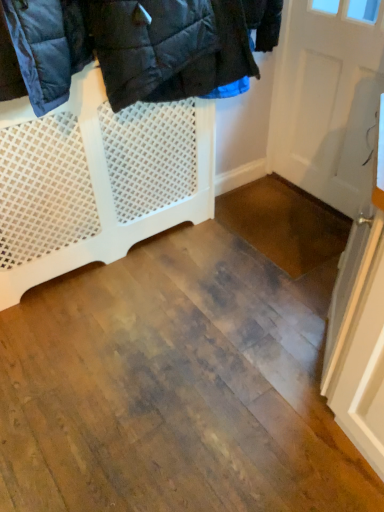
Question: Is white mesh gate at upper left in front of or behind white matte door at upper right in the image?

Choices:
 (A) front
 (B) behind

Answer: (A)

Question: From the image's perspective, is white mesh gate at upper left above or below white matte door at upper right?

Choices:
 (A) below
 (B) above

Answer: (A)

Question: Does point (8, 181) appear closer or farther from the camera than point (380, 78)?

Choices:
 (A) farther
 (B) closer

Answer: (B)

Question: Is white matte door at upper right to the left or to the right of white mesh gate at upper left in the image?

Choices:
 (A) right
 (B) left

Answer: (A)

Question: From the image's perspective, is white matte door at upper right located above or below white mesh gate at upper left?

Choices:
 (A) above
 (B) below

Answer: (A)

Question: Considering the positions of white matte door at upper right and white mesh gate at upper left in the image, is white matte door at upper right wider or thinner than white mesh gate at upper left?

Choices:
 (A) thin
 (B) wide

Answer: (A)

Question: From a real-world perspective, is white matte door at upper right positioned above or below white mesh gate at upper left?

Choices:
 (A) below
 (B) above

Answer: (B)